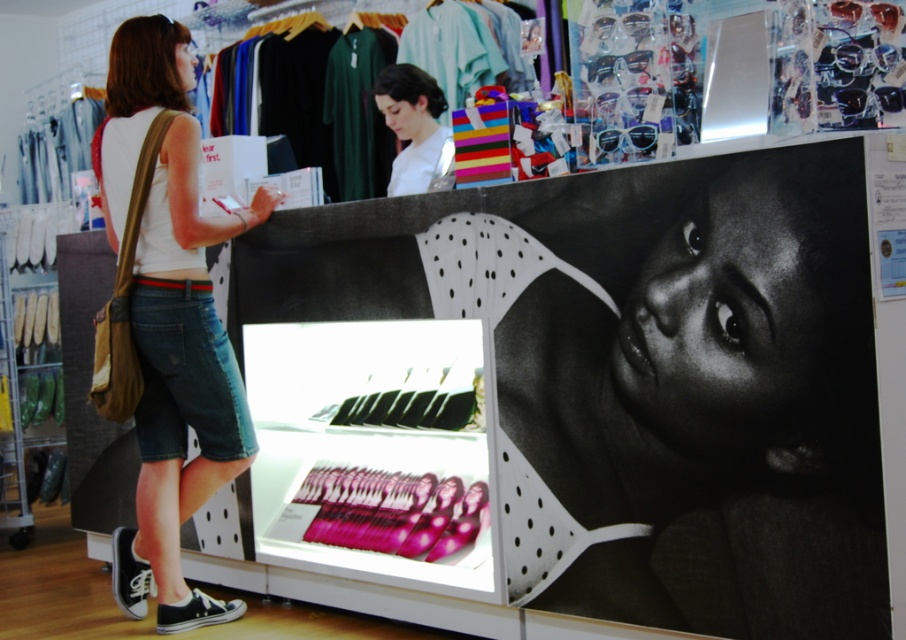
Question: Does metallic silver poster at center have a greater width compared to denim shorts at left?

Choices:
 (A) no
 (B) yes

Answer: (B)

Question: Can you confirm if metallic silver poster at center is thinner than denim shorts at left?

Choices:
 (A) yes
 (B) no

Answer: (B)

Question: Which point is farther to the camera?

Choices:
 (A) metallic silver poster at center
 (B) denim shorts at left
 (C) white matte shirt at upper center

Answer: (C)

Question: Is metallic silver poster at center wider than white matte shirt at upper center?

Choices:
 (A) no
 (B) yes

Answer: (B)

Question: Among these objects, which one is farthest from the camera?

Choices:
 (A) white matte shirt at upper center
 (B) metallic silver poster at center

Answer: (A)

Question: Which object is positioned farthest from the white matte shirt at upper center?

Choices:
 (A) denim shorts at left
 (B) metallic silver poster at center

Answer: (B)